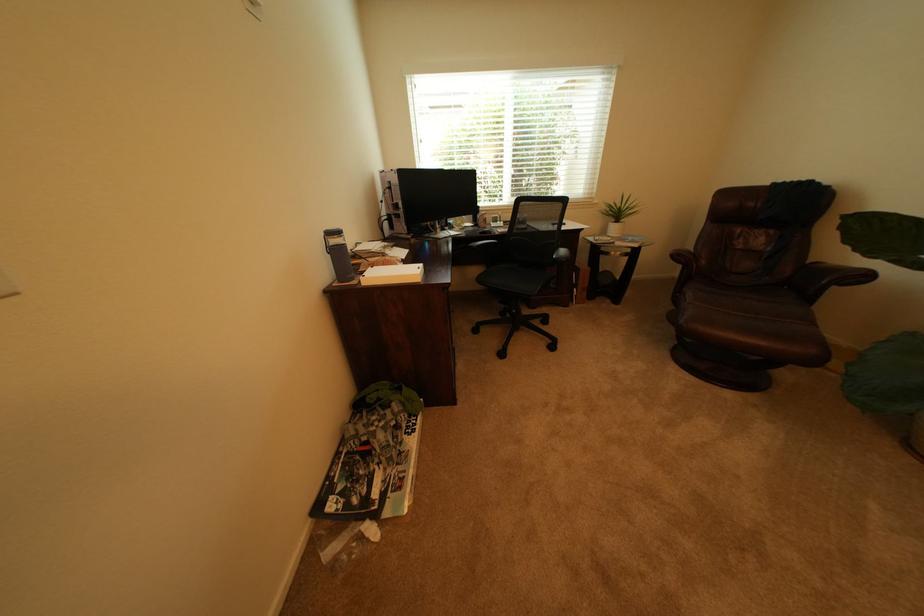
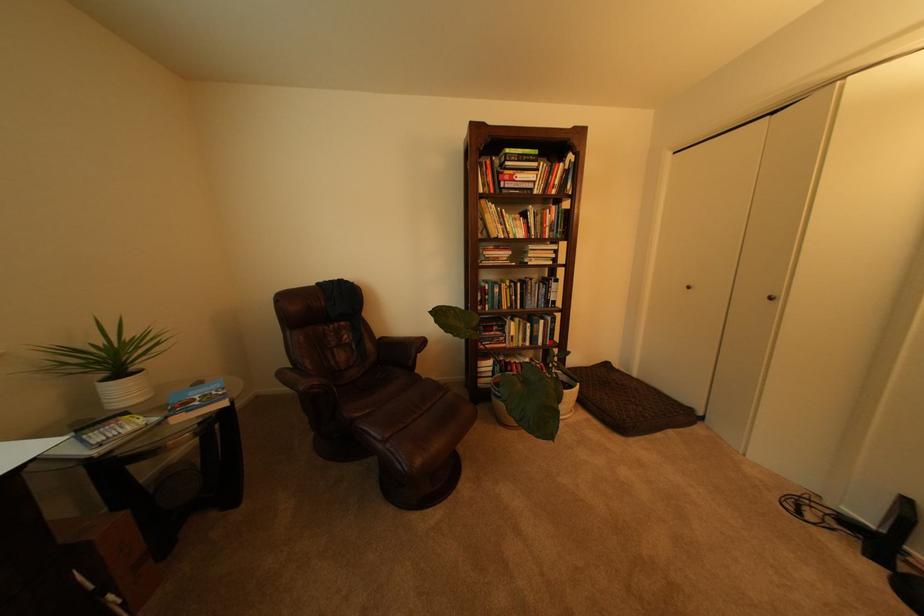
In the second image, find the point that corresponds to point (633, 222) in the first image.

(143, 370)